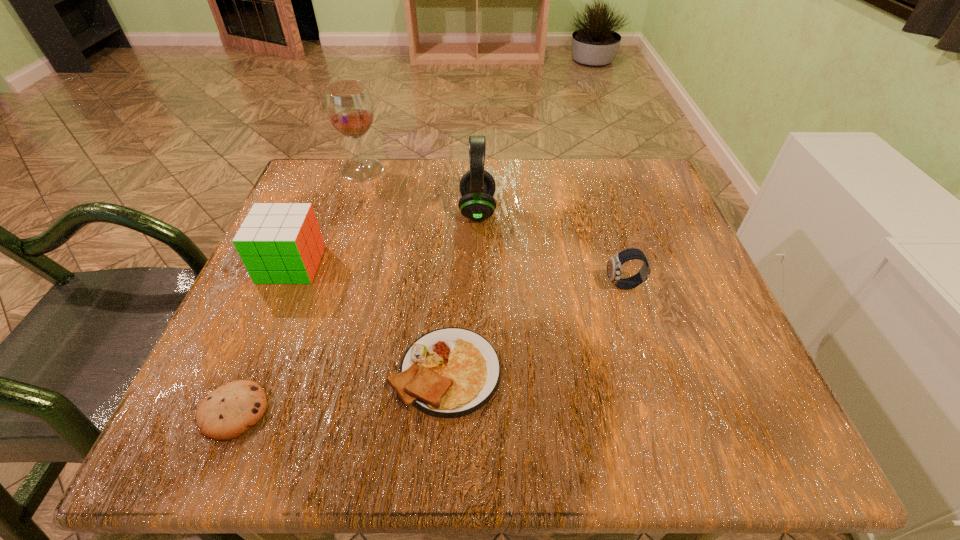
In order to click on vacant region at the right edge of the desktop in this screenshot , I will do `click(666, 390)`.

In the image, there is a desktop. At what (x,y) coordinates should I click in order to perform the action: click on vacant space at the far left corner. Please return your answer as a coordinate pair (x, y). Looking at the image, I should click on (317, 162).

This screenshot has width=960, height=540. I want to click on free space at the far right corner, so point(593,183).

Where is `vacant space at the near right corner of the desktop`? The height and width of the screenshot is (540, 960). vacant space at the near right corner of the desktop is located at coordinates (732, 421).

This screenshot has width=960, height=540. In order to click on free space between the fifth shortest object and the rightmost object in this screenshot , I will do `click(551, 248)`.

This screenshot has height=540, width=960. I want to click on free point between the cube and the wineglass, so click(327, 217).

This screenshot has width=960, height=540. In order to click on empty space that is in between the omelet and the rightmost object in this screenshot , I will do `click(535, 328)`.

Where is `free area in between the omelet and the cookie`? This screenshot has height=540, width=960. free area in between the omelet and the cookie is located at coordinates (340, 391).

At what (x,y) coordinates should I click in order to perform the action: click on free area in between the cube and the cookie. Please return your answer as a coordinate pair (x, y). This screenshot has height=540, width=960. Looking at the image, I should click on (262, 338).

Find the location of a particular element. The width and height of the screenshot is (960, 540). vacant area between the second tallest object and the tallest object is located at coordinates (420, 190).